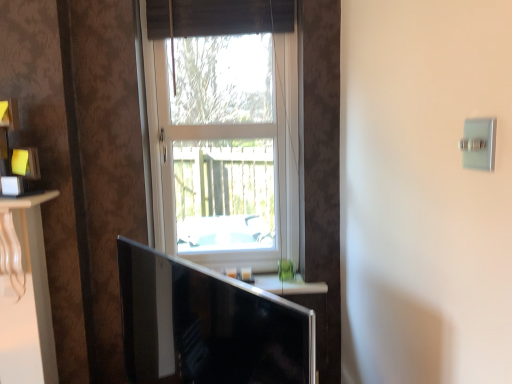
Question: Is white frame window at center not near black glossy monitor at lower center?

Choices:
 (A) yes
 (B) no

Answer: (B)

Question: From the image's perspective, does white frame window at center appear lower than black glossy monitor at lower center?

Choices:
 (A) no
 (B) yes

Answer: (A)

Question: Does white frame window at center have a greater height compared to black glossy monitor at lower center?

Choices:
 (A) yes
 (B) no

Answer: (A)

Question: From a real-world perspective, is white frame window at center physically above black glossy monitor at lower center?

Choices:
 (A) yes
 (B) no

Answer: (A)

Question: Is white frame window at center thinner than black glossy monitor at lower center?

Choices:
 (A) yes
 (B) no

Answer: (A)

Question: Can black glossy monitor at lower center be found inside white frame window at center?

Choices:
 (A) yes
 (B) no

Answer: (B)

Question: Considering the relative positions of black glossy monitor at lower center and brown woven curtain at upper center in the image provided, is black glossy monitor at lower center to the left of brown woven curtain at upper center from the viewer's perspective?

Choices:
 (A) no
 (B) yes

Answer: (B)

Question: From a real-world perspective, is black glossy monitor at lower center physically above brown woven curtain at upper center?

Choices:
 (A) yes
 (B) no

Answer: (B)

Question: Considering the relative positions of black glossy monitor at lower center and brown woven curtain at upper center in the image provided, is black glossy monitor at lower center in front of brown woven curtain at upper center?

Choices:
 (A) yes
 (B) no

Answer: (A)

Question: Does black glossy monitor at lower center appear on the right side of brown woven curtain at upper center?

Choices:
 (A) yes
 (B) no

Answer: (B)

Question: Can you confirm if black glossy monitor at lower center is shorter than brown woven curtain at upper center?

Choices:
 (A) yes
 (B) no

Answer: (B)

Question: Can we say black glossy monitor at lower center lies outside brown woven curtain at upper center?

Choices:
 (A) no
 (B) yes

Answer: (B)

Question: Considering the relative positions of black glossy monitor at lower center and satin silver switch at upper right in the image provided, is black glossy monitor at lower center to the right of satin silver switch at upper right from the viewer's perspective?

Choices:
 (A) no
 (B) yes

Answer: (A)